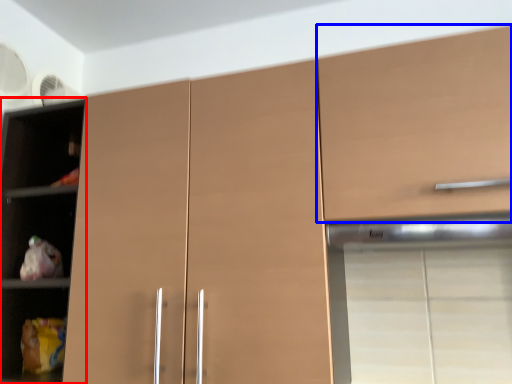
Question: Which object appears closest to the camera in this image, cupboard (highlighted by a red box) or cabinetry (highlighted by a blue box)?

Choices:
 (A) cupboard
 (B) cabinetry

Answer: (B)